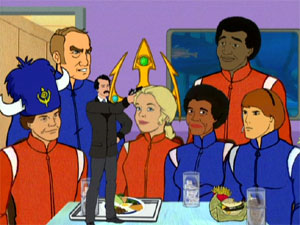
Locate an element on the screen. The width and height of the screenshot is (300, 225). door frame is located at coordinates (45, 10).